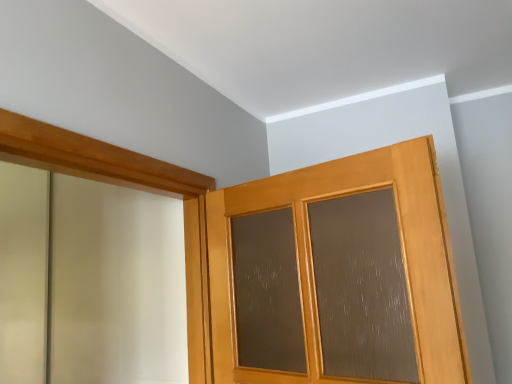
Question: Considering the positions of wooden barn door at upper left and matte wood door at center in the image, is wooden barn door at upper left taller or shorter than matte wood door at center?

Choices:
 (A) tall
 (B) short

Answer: (A)

Question: Considering their positions, is wooden barn door at upper left located in front of or behind matte wood door at center?

Choices:
 (A) behind
 (B) front

Answer: (B)

Question: Looking at the image, does wooden barn door at upper left seem bigger or smaller compared to matte wood door at center?

Choices:
 (A) small
 (B) big

Answer: (A)

Question: Considering the positions of matte wood door at center and wooden barn door at upper left in the image, is matte wood door at center taller or shorter than wooden barn door at upper left?

Choices:
 (A) short
 (B) tall

Answer: (A)

Question: Relative to wooden barn door at upper left, is matte wood door at center in front or behind?

Choices:
 (A) front
 (B) behind

Answer: (B)

Question: From the image's perspective, relative to wooden barn door at upper left, is matte wood door at center above or below?

Choices:
 (A) below
 (B) above

Answer: (A)

Question: Is point (373, 183) positioned closer to the camera than point (45, 122)?

Choices:
 (A) closer
 (B) farther

Answer: (B)